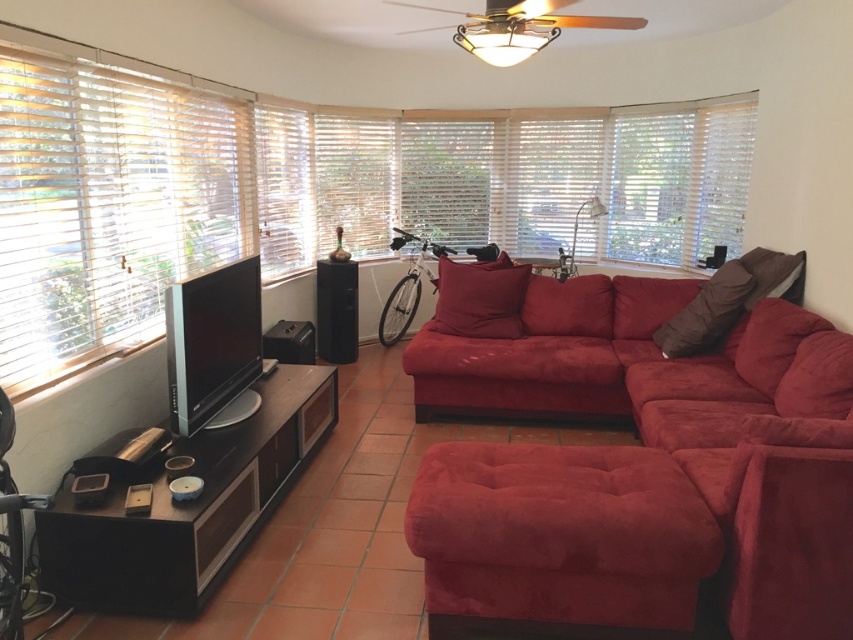
Question: Does brown suede pillow at right appear over black matte speaker at center?

Choices:
 (A) no
 (B) yes

Answer: (A)

Question: Which of the following is the farthest from the observer?

Choices:
 (A) wooden blinds at center
 (B) velvet cushion at center
 (C) white wood blinds at left

Answer: (A)

Question: Does velvet red ottoman at lower right come behind black matte speaker at center?

Choices:
 (A) yes
 (B) no

Answer: (B)

Question: Which point is farther to the camera?

Choices:
 (A) black matte speaker at center
 (B) velvet cushion at center
 (C) wooden blinds at center

Answer: (C)

Question: Which point is closer to the camera?

Choices:
 (A) black matte speaker at center
 (B) wooden blinds at center
 (C) velvet cushion at center
 (D) white wood blinds at left

Answer: (D)

Question: Can you confirm if suede-like red couch at lower right is positioned to the left of black matte speaker at center?

Choices:
 (A) no
 (B) yes

Answer: (A)